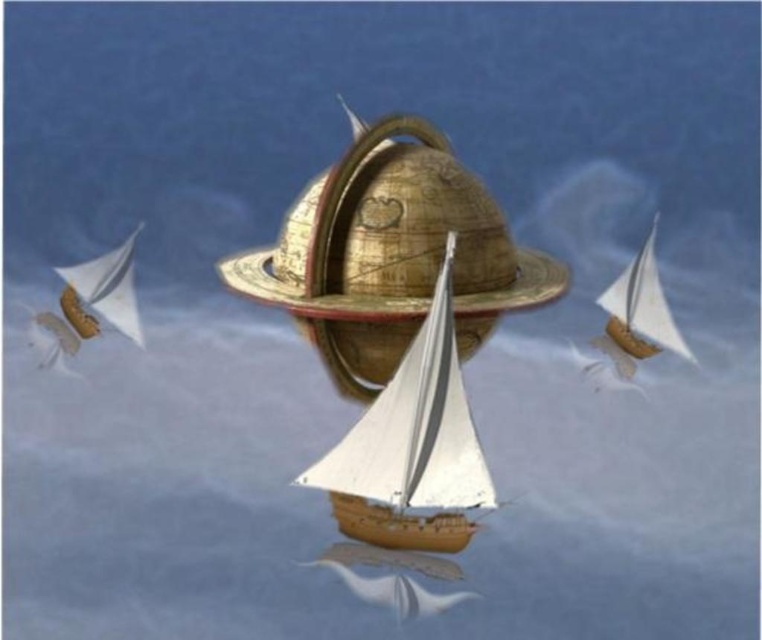
Question: Is gold metallic globe at center to the right of white matte sailboat at center from the viewer's perspective?

Choices:
 (A) yes
 (B) no

Answer: (A)

Question: Which point is farther from the camera taking this photo?

Choices:
 (A) (383, 467)
 (B) (239, 289)

Answer: (B)

Question: Does gold metallic globe at center appear under white matte sailboat at center?

Choices:
 (A) no
 (B) yes

Answer: (A)

Question: Which point is farther to the camera?

Choices:
 (A) (498, 296)
 (B) (370, 465)

Answer: (A)

Question: Can you confirm if gold metallic globe at center is positioned above white matte sailboat at center?

Choices:
 (A) yes
 (B) no

Answer: (A)